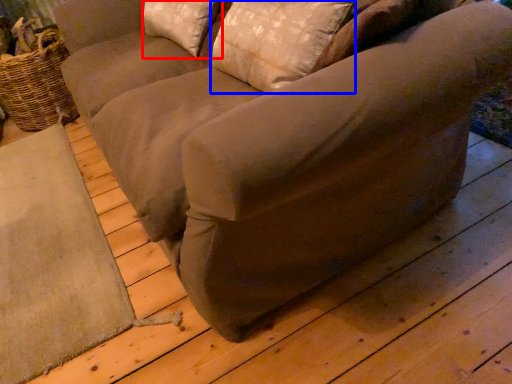
Question: Which of the following is the closest to the observer, pillow (highlighted by a red box) or pillow (highlighted by a blue box)?

Choices:
 (A) pillow
 (B) pillow

Answer: (B)